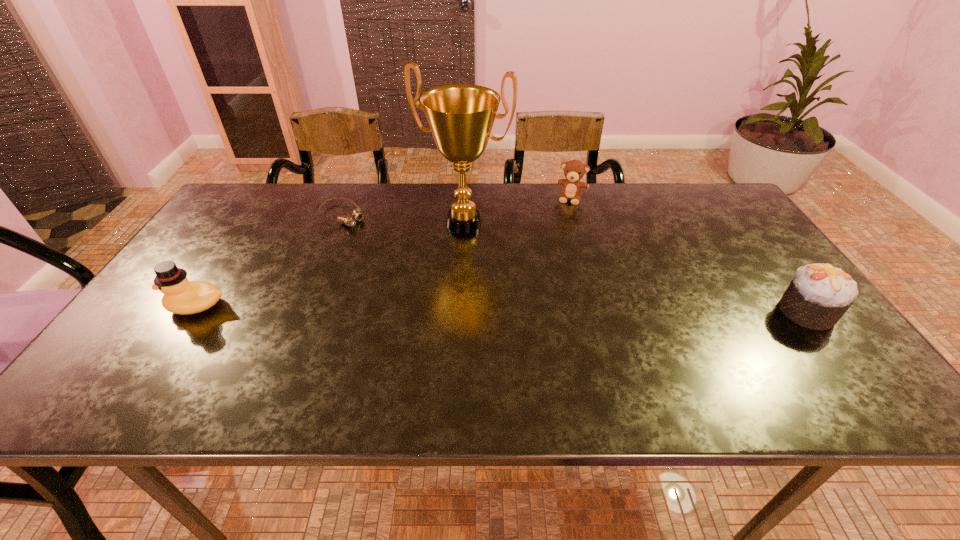
Locate an element on the screen. The image size is (960, 540). free space on the desktop that is between the leftmost object and the rightmost object and is positioned on the front view with handles of the tallest object is located at coordinates (417, 308).

You are a GUI agent. You are given a task and a screenshot of the screen. Output one action in this format:
    pyautogui.click(x=<x>, y=<y>)
    Task: Click on the vacant space on the desktop that is between the leftmost object and the cupcake and is positioned on the face of the teddy bear
    This screenshot has height=540, width=960.
    Given the screenshot: What is the action you would take?
    pyautogui.click(x=540, y=309)

Locate an element on the screen. free space on the desktop that is between the duck and the rightmost object and is positioned on the front lenses and sides of the second object from left to right is located at coordinates (478, 308).